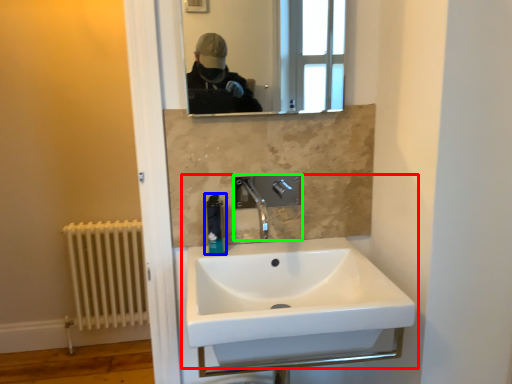
Question: Which is farther away from sink (highlighted by a red box)? soap dispenser (highlighted by a blue box) or tap (highlighted by a green box)?

Choices:
 (A) soap dispenser
 (B) tap

Answer: (A)